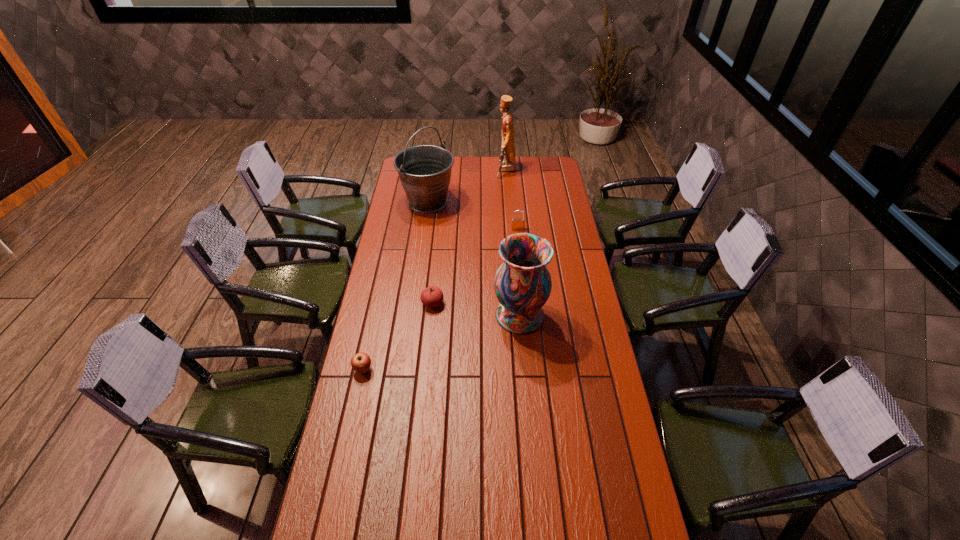
Find the location of a particular element. object identified as the third closest to the nearest object is located at coordinates (425, 170).

Identify which object is located as the third nearest to the second farthest object. Please provide its 2D coordinates. Your answer should be formatted as a tuple, i.e. [(x, y)], where the tuple contains the x and y coordinates of a point satisfying the conditions above.

[(432, 296)]

Locate an element on the screen. This screenshot has height=540, width=960. vacant area in the image that satisfies the following two spatial constraints: 1. on the front-facing side of the nutcracker; 2. on the back side of the vase is located at coordinates (517, 315).

You are a GUI agent. You are given a task and a screenshot of the screen. Output one action in this format:
    pyautogui.click(x=<x>, y=<y>)
    Task: Click on the free space in the image that satisfies the following two spatial constraints: 1. on the back side of the nearest object; 2. on the left side of the tomato
    Image resolution: width=960 pixels, height=540 pixels.
    Given the screenshot: What is the action you would take?
    pyautogui.click(x=377, y=303)

Where is `free region that satisfies the following two spatial constraints: 1. on the front-facing side of the nutcracker; 2. on the front side of the second farthest object`? Image resolution: width=960 pixels, height=540 pixels. free region that satisfies the following two spatial constraints: 1. on the front-facing side of the nutcracker; 2. on the front side of the second farthest object is located at coordinates (509, 202).

At what (x,y) coordinates should I click in order to perform the action: click on vacant space that satisfies the following two spatial constraints: 1. on the front-facing side of the nutcracker; 2. on the front side of the bucket. Please return your answer as a coordinate pair (x, y). Image resolution: width=960 pixels, height=540 pixels. Looking at the image, I should click on (509, 202).

Where is `vacant point that satisfies the following two spatial constraints: 1. on the back side of the vase; 2. on the front-facing side of the nutcracker`? The width and height of the screenshot is (960, 540). vacant point that satisfies the following two spatial constraints: 1. on the back side of the vase; 2. on the front-facing side of the nutcracker is located at coordinates (508, 170).